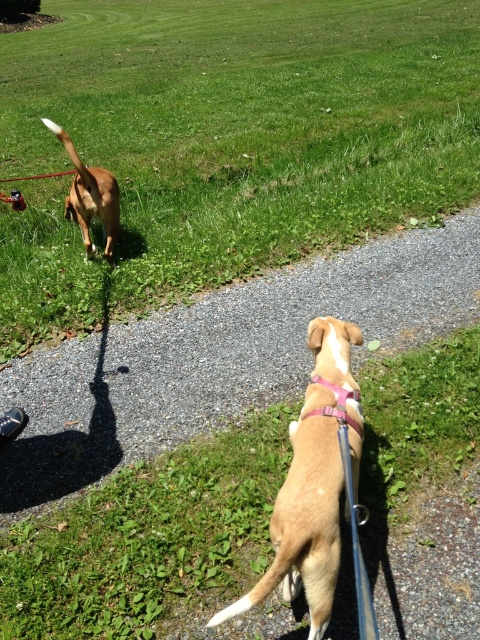
Where is `light brown fur at center`? Image resolution: width=480 pixels, height=640 pixels. light brown fur at center is located at coordinates (313, 481).

Who is positioned more to the right, light brown fur at center or brown fur dog at upper left?

light brown fur at center is more to the right.

Image resolution: width=480 pixels, height=640 pixels. What do you see at coordinates (313, 481) in the screenshot? I see `light brown fur at center` at bounding box center [313, 481].

Where is `light brown fur at center`? The image size is (480, 640). light brown fur at center is located at coordinates (313, 481).

At what (x,y) coordinates should I click in order to perform the action: click on green grass at upper center. Please return your answer as a coordinate pair (x, y). This screenshot has height=640, width=480. Looking at the image, I should click on (227, 140).

Find the location of `green grass at upper center`. green grass at upper center is located at coordinates (227, 140).

Does green grass at upper center come in front of pink fabric neckband at center?

No, green grass at upper center is behind pink fabric neckband at center.

Which is below, green grass at upper center or pink fabric neckband at center?

pink fabric neckband at center is lower down.

Does point (278, 240) come behind point (322, 378)?

Yes, it is.

At what (x,y) coordinates should I click in order to perform the action: click on green grass at upper center. Please return your answer as a coordinate pair (x, y). This screenshot has width=480, height=640. Looking at the image, I should click on (227, 140).